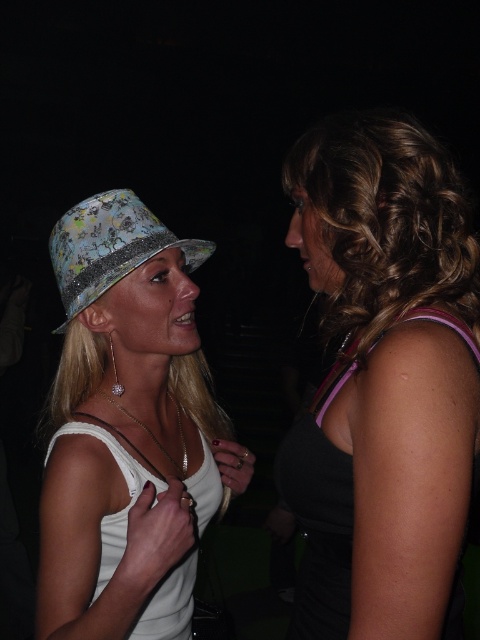
Is shiny black dress at right bigger than white fabric dress at center?

Yes, shiny black dress at right is bigger than white fabric dress at center.

Can you confirm if shiny black dress at right is positioned to the right of white fabric dress at center?

Correct, you'll find shiny black dress at right to the right of white fabric dress at center.

Between point (406, 269) and point (121, 451), which one is positioned behind?

The point (121, 451) is behind.

Image resolution: width=480 pixels, height=640 pixels. In order to click on shiny black dress at right in this screenshot , I will do `click(384, 380)`.

Who is lower down, glittery floral hat at left or white fabric dress at center?

white fabric dress at center

Who is higher up, glittery floral hat at left or white fabric dress at center?

glittery floral hat at left

Locate an element on the screen. glittery floral hat at left is located at coordinates (109, 246).

Identify the location of glittery floral hat at left. (109, 246).

Does shiny floral hat at left have a smaller size compared to white fabric dress at center?

No, shiny floral hat at left is not smaller than white fabric dress at center.

Looking at this image, which of these two, shiny floral hat at left or white fabric dress at center, stands taller?

Standing taller between the two is shiny floral hat at left.

The image size is (480, 640). I want to click on shiny floral hat at left, so click(129, 429).